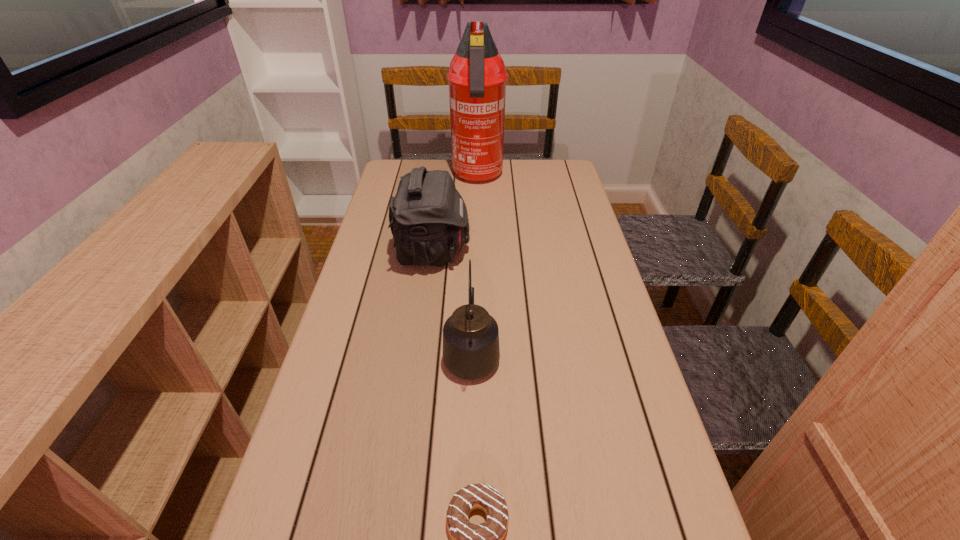
Image resolution: width=960 pixels, height=540 pixels. In order to click on fire extinguisher in this screenshot , I will do `click(477, 76)`.

Where is `the tallest object`? The width and height of the screenshot is (960, 540). the tallest object is located at coordinates (477, 76).

Locate an element on the screen. the second nearest object is located at coordinates (471, 350).

What are the coordinates of `the third nearest object` in the screenshot? It's located at tap(428, 217).

The height and width of the screenshot is (540, 960). Find the location of `vacant space located 0.180m on the trigger side of the fire extinguisher`. vacant space located 0.180m on the trigger side of the fire extinguisher is located at coordinates (477, 222).

This screenshot has height=540, width=960. I want to click on vacant region located 0.160m spout on the kettle, so click(x=472, y=282).

Locate an element on the screen. vacant region located spout on the kettle is located at coordinates (473, 254).

The width and height of the screenshot is (960, 540). Identify the location of free space located 0.100m spout on the kettle. (472, 297).

Find the location of `free space located 0.310m on the open flap of the shoulder bag`. free space located 0.310m on the open flap of the shoulder bag is located at coordinates (570, 252).

Locate an element on the screen. The width and height of the screenshot is (960, 540). object located in the far edge section of the desktop is located at coordinates (477, 76).